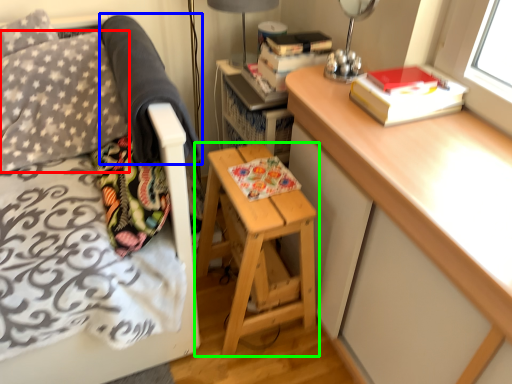
Question: Which object is the farthest from throw pillow (highlighted by a red box)? Choose among these: blanket (highlighted by a blue box) or stool (highlighted by a green box).

Choices:
 (A) blanket
 (B) stool

Answer: (B)